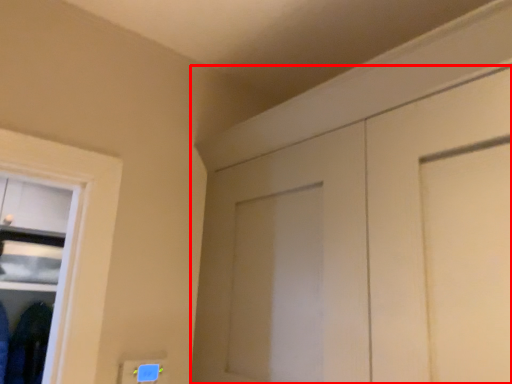
Question: Considering the relative positions of door (annotated by the red box) and clothing in the image provided, where is door (annotated by the red box) located with respect to the staircase?

Choices:
 (A) right
 (B) left

Answer: (A)